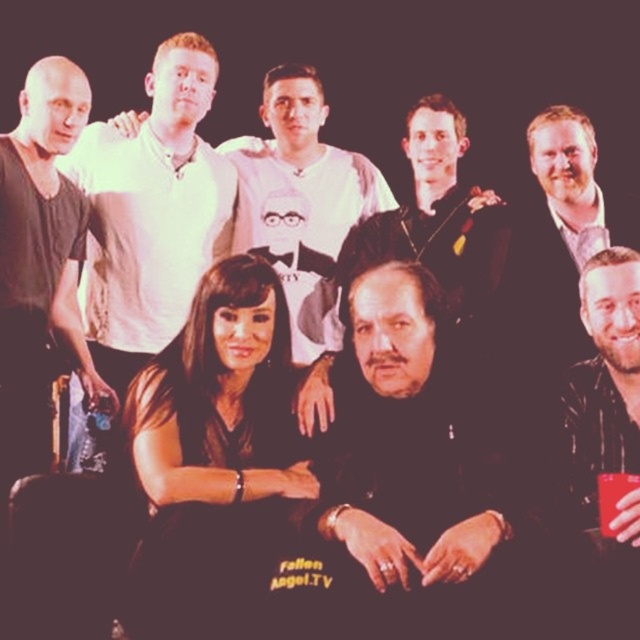
Question: Considering the real-world distances, which object is closest to the shiny black jacket at lower right?

Choices:
 (A) black matte suitcase at left
 (B) black matte jacket at center

Answer: (B)

Question: Is white matte shirt at upper center below matte black shirt at center?

Choices:
 (A) no
 (B) yes

Answer: (A)

Question: Which point is farther from the camera taking this photo?

Choices:
 (A) (132, 172)
 (B) (368, 237)
 (C) (579, 284)
 (D) (298, 321)

Answer: (D)

Question: Which point is farther from the camera taking this photo?

Choices:
 (A) (240, 225)
 (B) (81, 88)

Answer: (A)

Question: Is shiny black jacket at lower right above matte black shirt at center?

Choices:
 (A) no
 (B) yes

Answer: (A)

Question: Does matte white shirt at upper left lie behind shiny black jacket at lower right?

Choices:
 (A) yes
 (B) no

Answer: (A)